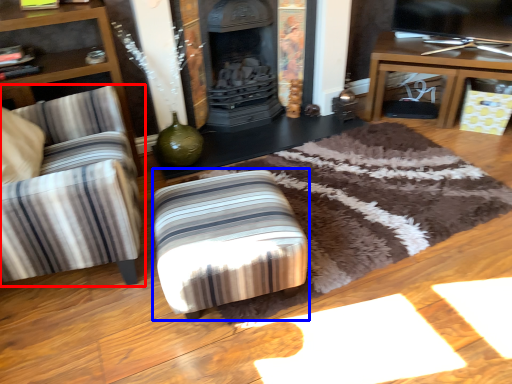
Question: Among these objects, which one is farthest to the camera, chair (highlighted by a red box) or stool (highlighted by a blue box)?

Choices:
 (A) chair
 (B) stool

Answer: (B)